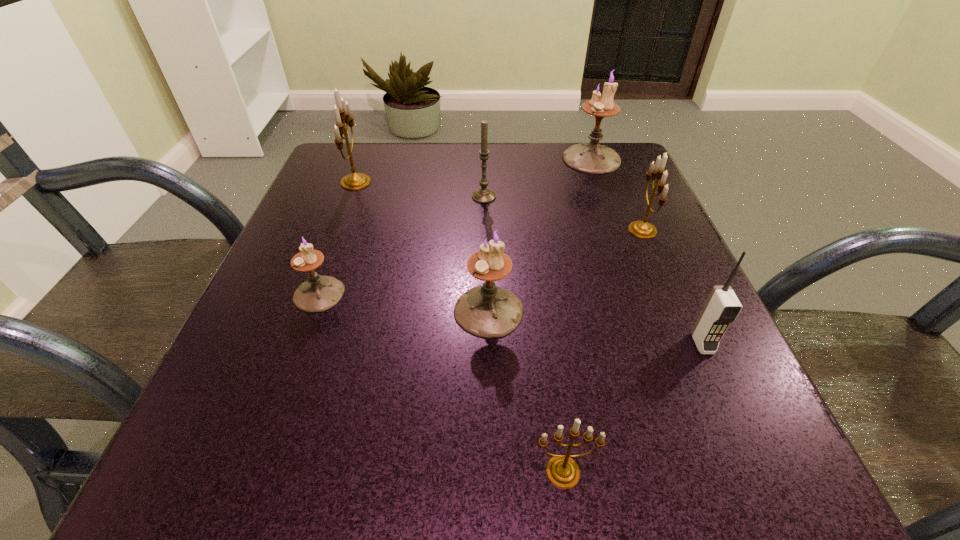
Locate an element on the screen. free space that satisfies the following two spatial constraints: 1. on the front side of the candle; 2. on the left side of the fifth nearest object is located at coordinates (484, 230).

Find the location of a particular element. This screenshot has height=540, width=960. free space that satisfies the following two spatial constraints: 1. on the front side of the biggest gold candelabrum; 2. on the left side of the smallest purple candle holder is located at coordinates (314, 294).

Where is `free space that satisfies the following two spatial constraints: 1. on the front side of the nearest gold candelabrum; 2. on the right side of the second smallest purple candle holder`? The height and width of the screenshot is (540, 960). free space that satisfies the following two spatial constraints: 1. on the front side of the nearest gold candelabrum; 2. on the right side of the second smallest purple candle holder is located at coordinates (492, 472).